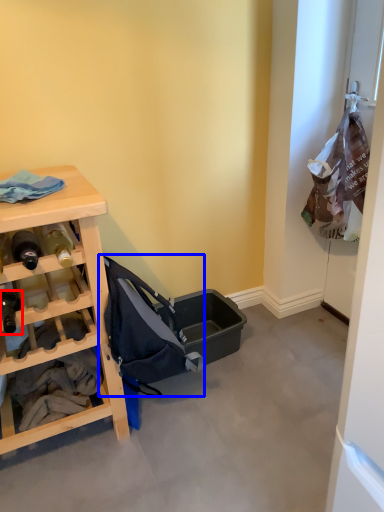
Question: Which of the following is the closest to the observer, bottle (highlighted by a red box) or baby carriage (highlighted by a blue box)?

Choices:
 (A) bottle
 (B) baby carriage

Answer: (A)